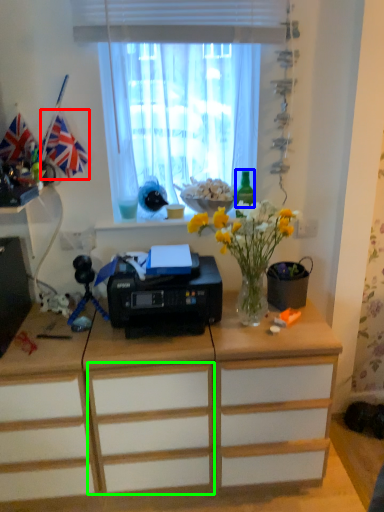
Question: Which object is the farthest from flag (highlighted by a red box)? Choose among these: bottle (highlighted by a blue box) or drawer (highlighted by a green box).

Choices:
 (A) bottle
 (B) drawer

Answer: (B)